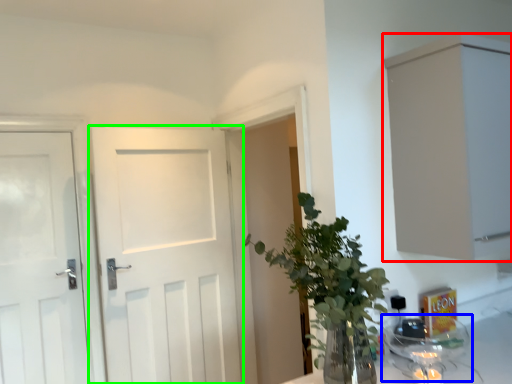
Question: Based on their relative distances, which object is nearer to cabinetry (highlighted by a red box)? Choose from glass jar (highlighted by a blue box) and door (highlighted by a green box).

Choices:
 (A) glass jar
 (B) door

Answer: (A)